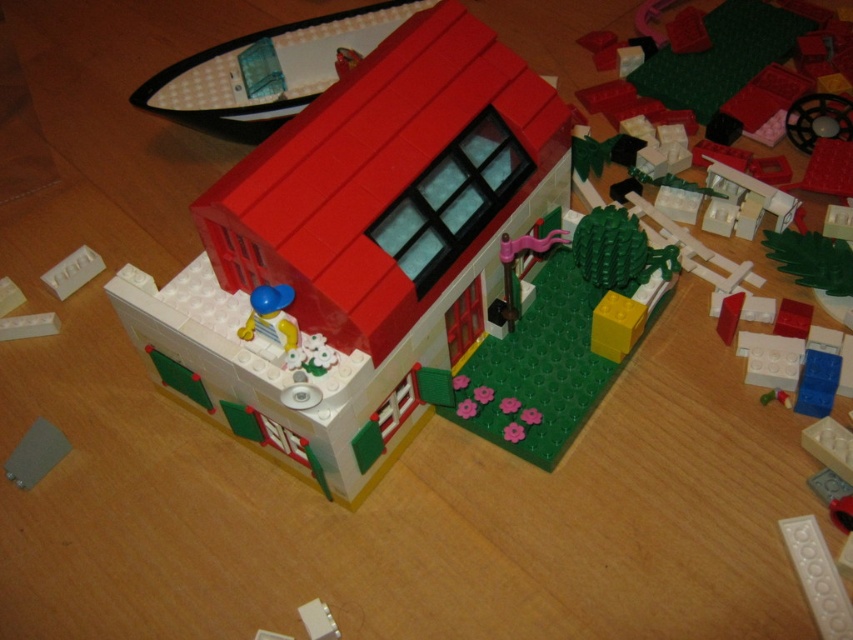
You are trying to place a new Lego piece that is 10 cm wide. You have two options on the wooden surface where the house is built. The smooth gray plate at lower left and the white matte brick at center. Which one can accommodate the new piece if the width is the only concern?

The white matte brick at center has a greater width than the smooth gray plate at lower left, so the white matte brick at center can accommodate the new 10 cm wide Lego piece if its width is sufficient.

You are a Lego figure trying to find your way to the smooth plastic house at center. You are currently standing at the point with coordinates (358,250). Can you confirm if you are already at the smooth plastic house at center?

The point at coordinates (358,250) indicates the location of the smooth plastic house at center, so yes, you are already at the smooth plastic house at center.

You are a Lego figure trying to reach the white matte brick at center from the smooth plastic house at center. Which direction should you move to get there?

The smooth plastic house at center is in front of the white matte brick at center, so you should move backward to reach the white matte brick at center.